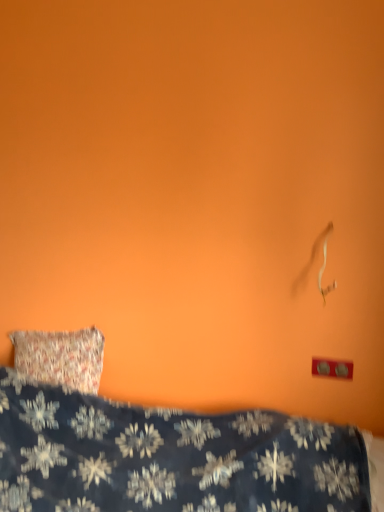
Question: Is red plastic outlet at lower right shorter than dark blue fabric with snowflake pattern at lower left?

Choices:
 (A) yes
 (B) no

Answer: (A)

Question: Does red plastic outlet at lower right appear on the right side of dark blue fabric with snowflake pattern at lower left?

Choices:
 (A) no
 (B) yes

Answer: (B)

Question: Does red plastic outlet at lower right contain dark blue fabric with snowflake pattern at lower left?

Choices:
 (A) no
 (B) yes

Answer: (A)

Question: Does red plastic outlet at lower right come in front of dark blue fabric with snowflake pattern at lower left?

Choices:
 (A) yes
 (B) no

Answer: (B)

Question: From a real-world perspective, is red plastic outlet at lower right physically below dark blue fabric with snowflake pattern at lower left?

Choices:
 (A) yes
 (B) no

Answer: (B)

Question: Is red plastic outlet at lower right directly adjacent to dark blue fabric with snowflake pattern at lower left?

Choices:
 (A) yes
 (B) no

Answer: (B)

Question: From a real-world perspective, is dark blue fabric with snowflake pattern at lower left positioned under red plastic outlet at lower right based on gravity?

Choices:
 (A) yes
 (B) no

Answer: (A)

Question: From the image's perspective, is dark blue fabric with snowflake pattern at lower left on red plastic outlet at lower right?

Choices:
 (A) no
 (B) yes

Answer: (A)

Question: Is the position of dark blue fabric with snowflake pattern at lower left less distant than that of red plastic outlet at lower right?

Choices:
 (A) no
 (B) yes

Answer: (B)

Question: Are dark blue fabric with snowflake pattern at lower left and red plastic outlet at lower right located far from each other?

Choices:
 (A) no
 (B) yes

Answer: (A)

Question: Is dark blue fabric with snowflake pattern at lower left at the left side of red plastic outlet at lower right?

Choices:
 (A) yes
 (B) no

Answer: (A)

Question: Can you confirm if dark blue fabric with snowflake pattern at lower left is positioned to the right of red plastic outlet at lower right?

Choices:
 (A) no
 (B) yes

Answer: (A)

Question: In terms of size, does red plastic outlet at lower right appear bigger or smaller than dark blue fabric with snowflake pattern at lower left?

Choices:
 (A) big
 (B) small

Answer: (B)